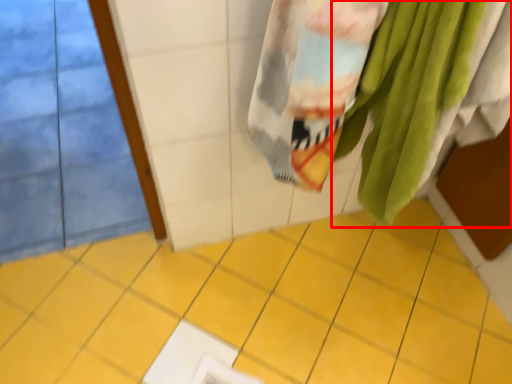
Question: From the image's perspective, what is the correct spatial relationship of towel (annotated by the red box) in relation to ceramic tile?

Choices:
 (A) below
 (B) above

Answer: (B)